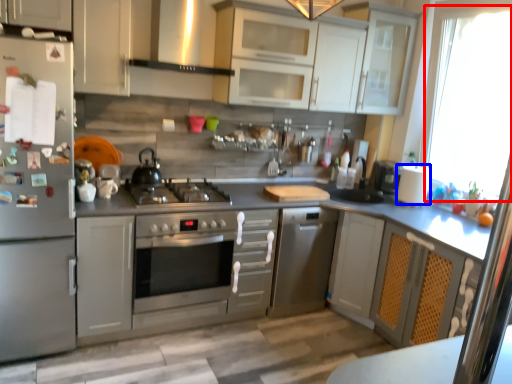
Question: Which of the following is the farthest to the observer, window screen (highlighted by a red box) or paper towel (highlighted by a blue box)?

Choices:
 (A) window screen
 (B) paper towel

Answer: (B)